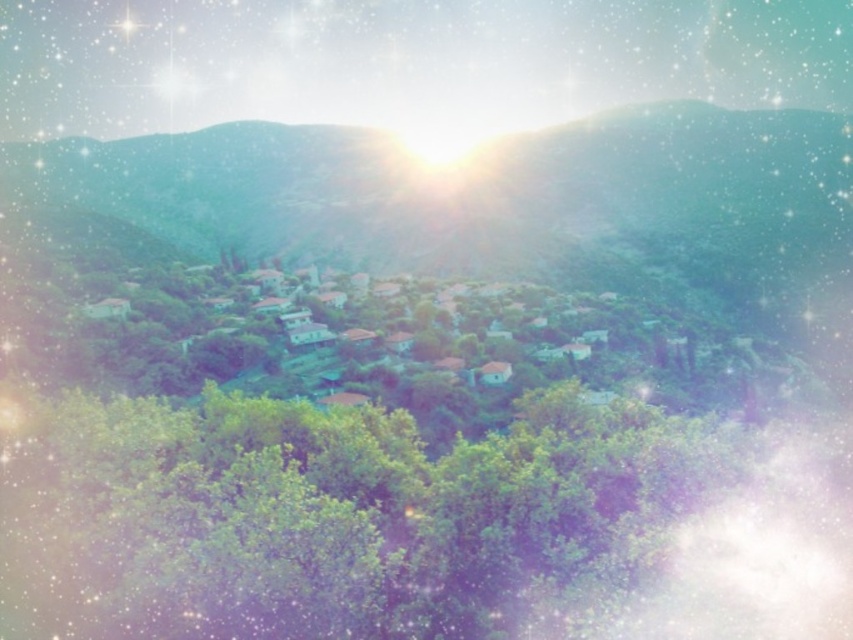
Question: Does green leafy tree at lower left have a lesser width compared to green matte hillside at center?

Choices:
 (A) no
 (B) yes

Answer: (B)

Question: Among these objects, which one is farthest from the camera?

Choices:
 (A) green matte hillside at center
 (B) green leafy tree at lower left

Answer: (A)

Question: Which point is closer to the camera taking this photo?

Choices:
 (A) [310, 624]
 (B) [155, 147]

Answer: (A)

Question: Can you confirm if green leafy tree at lower left is thinner than green matte hillside at center?

Choices:
 (A) yes
 (B) no

Answer: (A)

Question: Does green leafy tree at lower left have a greater width compared to green matte hillside at center?

Choices:
 (A) yes
 (B) no

Answer: (B)